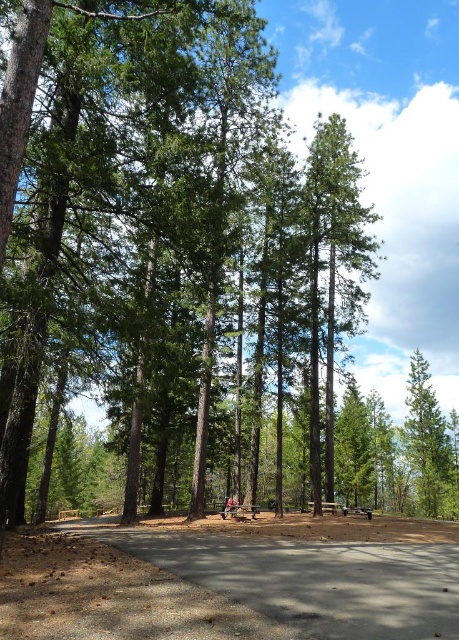
Question: Estimate the real-world distances between objects in this image. Which object is closer to the green rough bark tree at center?

Choices:
 (A) wooden park bench at center
 (B) wooden picnic table at center
 (C) green matte tree at right

Answer: (A)

Question: Does green matte tree at right have a greater width compared to wooden picnic table at center?

Choices:
 (A) yes
 (B) no

Answer: (A)

Question: Which object is positioned closest to the green rough bark tree at center?

Choices:
 (A) green matte tree at right
 (B) wooden picnic table at center

Answer: (B)

Question: Is green matte tree at right behind wooden park bench at center?

Choices:
 (A) no
 (B) yes

Answer: (B)

Question: Where is green matte tree at right located in relation to wooden picnic table at center in the image?

Choices:
 (A) above
 (B) below

Answer: (B)

Question: Which of the following is the farthest from the observer?

Choices:
 (A) (312, 392)
 (B) (370, 516)
 (C) (233, 516)

Answer: (A)